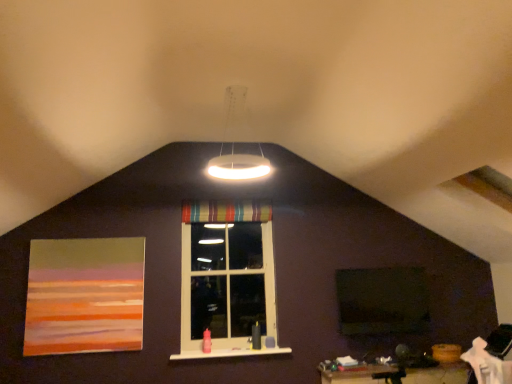
Question: Can you confirm if green matte window screen at center is smaller than white glossy ring light at upper center?

Choices:
 (A) yes
 (B) no

Answer: (A)

Question: Considering the relative sizes of green matte window screen at center and white glossy ring light at upper center in the image provided, is green matte window screen at center shorter than white glossy ring light at upper center?

Choices:
 (A) no
 (B) yes

Answer: (A)

Question: Does green matte window screen at center have a larger size compared to white glossy ring light at upper center?

Choices:
 (A) no
 (B) yes

Answer: (A)

Question: Is white glossy ring light at upper center inside green matte window screen at center?

Choices:
 (A) no
 (B) yes

Answer: (A)

Question: Is green matte window screen at center at the left side of white glossy ring light at upper center?

Choices:
 (A) yes
 (B) no

Answer: (B)

Question: In terms of width, does striped fabric curtain at center look wider or thinner when compared to matte acrylic painting at left?

Choices:
 (A) thin
 (B) wide

Answer: (B)

Question: From a real-world perspective, relative to matte acrylic painting at left, is striped fabric curtain at center vertically above or below?

Choices:
 (A) above
 (B) below

Answer: (A)

Question: Is striped fabric curtain at center spatially inside matte acrylic painting at left, or outside of it?

Choices:
 (A) inside
 (B) outside

Answer: (B)

Question: Considering the positions of striped fabric curtain at center and matte acrylic painting at left in the image, is striped fabric curtain at center taller or shorter than matte acrylic painting at left?

Choices:
 (A) tall
 (B) short

Answer: (B)

Question: Considering the positions of white glossy ring light at upper center and green matte window screen at center in the image, is white glossy ring light at upper center taller or shorter than green matte window screen at center?

Choices:
 (A) tall
 (B) short

Answer: (B)

Question: Considering the positions of white glossy ring light at upper center and green matte window screen at center in the image, is white glossy ring light at upper center bigger or smaller than green matte window screen at center?

Choices:
 (A) big
 (B) small

Answer: (A)

Question: From the image's perspective, relative to green matte window screen at center, is white glossy ring light at upper center above or below?

Choices:
 (A) above
 (B) below

Answer: (A)

Question: Based on their positions, is white glossy ring light at upper center located to the left or right of green matte window screen at center?

Choices:
 (A) right
 (B) left

Answer: (B)

Question: Looking at the image, does white glossy ring light at upper center seem bigger or smaller compared to striped fabric curtain at center?

Choices:
 (A) big
 (B) small

Answer: (A)

Question: Is white glossy ring light at upper center situated inside striped fabric curtain at center or outside?

Choices:
 (A) outside
 (B) inside

Answer: (A)